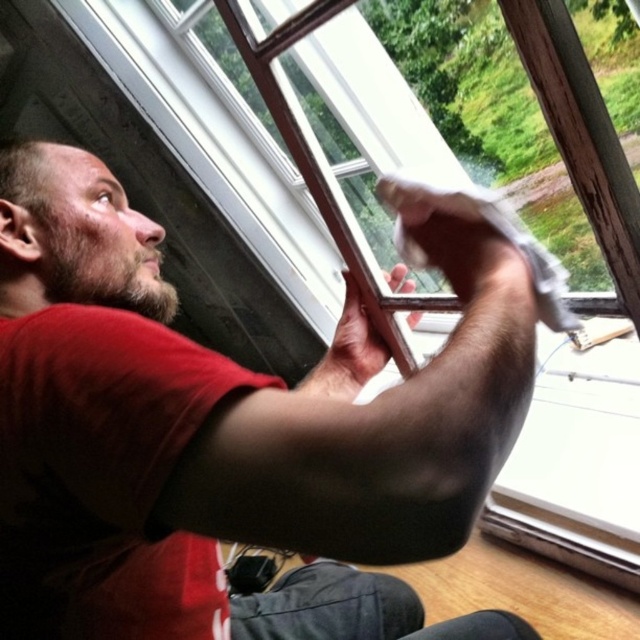
Consider the image. Does matte red t-shirt at center have a larger size compared to brownwoollybeard at left?

Yes, matte red t-shirt at center is bigger than brownwoollybeard at left.

Describe the element at coordinates (227, 435) in the screenshot. I see `matte red t-shirt at center` at that location.

Which is in front, point (108, 476) or point (134, 248)?

Point (108, 476) is in front.

The height and width of the screenshot is (640, 640). Identify the location of matte red t-shirt at center. (227, 435).